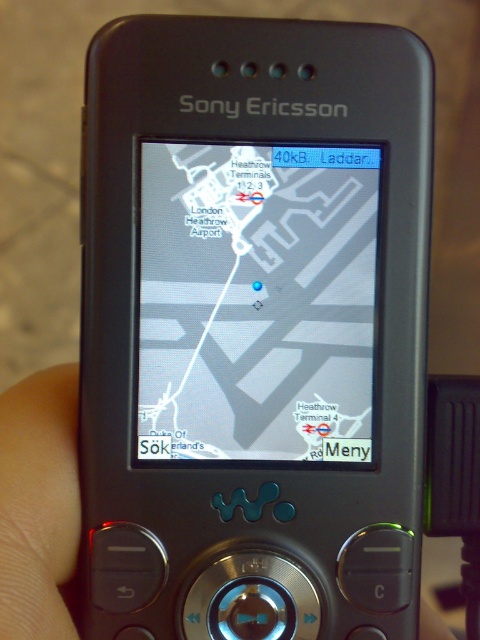
Does matte gray map at center have a greater width compared to skin/soft/hand at lower left?

Correct, the width of matte gray map at center exceeds that of skin/soft/hand at lower left.

Does matte gray map at center have a greater height compared to skin/soft/hand at lower left?

Yes.

You are a GUI agent. You are given a task and a screenshot of the screen. Output one action in this format:
    pyautogui.click(x=<x>, y=<y>)
    Task: Click on the matte gray map at center
    
    Given the screenshot: What is the action you would take?
    pyautogui.click(x=256, y=301)

You are a GUI agent. You are given a task and a screenshot of the screen. Output one action in this format:
    pyautogui.click(x=<x>, y=<y>)
    Task: Click on the matte gray map at center
    This screenshot has width=480, height=640.
    Given the screenshot: What is the action you would take?
    coord(256,301)

Does black matte sony ericsson phone at center appear over matte gray map at center?

Actually, black matte sony ericsson phone at center is below matte gray map at center.

Is black matte sony ericsson phone at center closer to camera compared to matte gray map at center?

Yes.

Which is in front, point (121, 282) or point (347, 202)?

Point (121, 282) is in front.

In order to click on black matte sony ericsson phone at center in this screenshot , I will do `click(252, 326)`.

Is black matte sony ericsson phone at center to the right of skin/soft/hand at lower left from the viewer's perspective?

Yes, black matte sony ericsson phone at center is to the right of skin/soft/hand at lower left.

Which is in front, point (417, 296) or point (11, 609)?

Point (11, 609) is in front.

Locate an element on the screen. black matte sony ericsson phone at center is located at coordinates (252, 326).